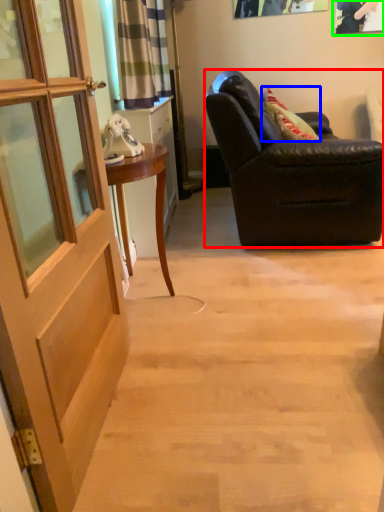
Question: Which object is the farthest from chair (highlighted by a red box)? Choose among these: pillow (highlighted by a blue box) or picture frame (highlighted by a green box).

Choices:
 (A) pillow
 (B) picture frame

Answer: (B)